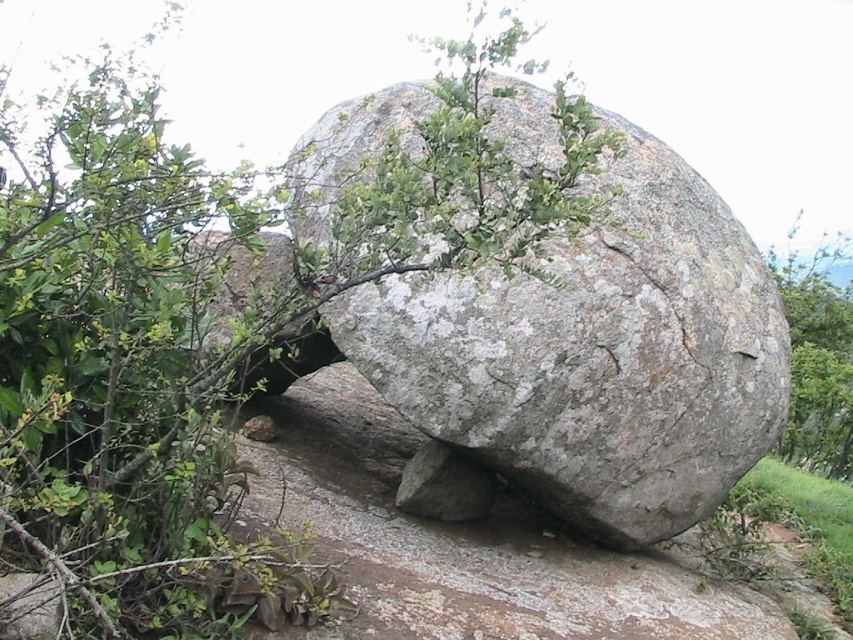
Question: Among these objects, which one is farthest from the camera?

Choices:
 (A) green leafy tree at center
 (B) green leafy tree at right
 (C) gray rough boulder at center

Answer: (B)

Question: Can you confirm if green leafy tree at center is positioned above gray rough boulder at center?

Choices:
 (A) no
 (B) yes

Answer: (B)

Question: Which is nearer to the green leafy tree at right?

Choices:
 (A) gray rough boulder at center
 (B) green leafy tree at center

Answer: (A)

Question: In this image, where is green leafy tree at center located relative to green leafy tree at right?

Choices:
 (A) above
 (B) below

Answer: (A)

Question: Based on their relative distances, which object is farther from the green leafy tree at right?

Choices:
 (A) green leafy tree at center
 (B) gray rough boulder at center

Answer: (A)

Question: Can you confirm if green leafy tree at center is bigger than gray rough boulder at center?

Choices:
 (A) yes
 (B) no

Answer: (A)